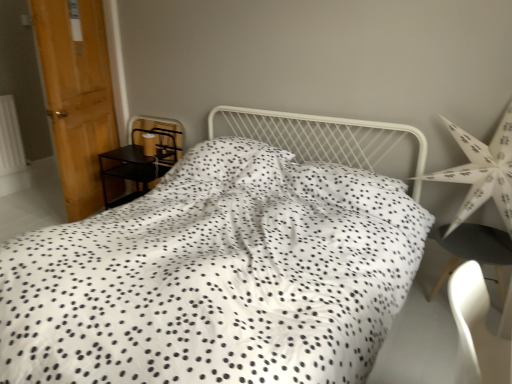
Question: Can you confirm if black metal nightstand at left is wider than matte brown lampshade at left?

Choices:
 (A) yes
 (B) no

Answer: (A)

Question: From a real-world perspective, is black metal nightstand at left below matte brown lampshade at left?

Choices:
 (A) no
 (B) yes

Answer: (B)

Question: From the image's perspective, does black metal nightstand at left appear lower than matte brown lampshade at left?

Choices:
 (A) yes
 (B) no

Answer: (A)

Question: Is the depth of black metal nightstand at left greater than that of matte brown lampshade at left?

Choices:
 (A) no
 (B) yes

Answer: (A)

Question: Is black metal nightstand at left turned away from matte brown lampshade at left?

Choices:
 (A) no
 (B) yes

Answer: (A)

Question: From a real-world perspective, is black metal nightstand at left physically above matte brown lampshade at left?

Choices:
 (A) yes
 (B) no

Answer: (B)

Question: Considering the relative positions of white paper star at right and matte brown lampshade at left in the image provided, is white paper star at right behind matte brown lampshade at left?

Choices:
 (A) no
 (B) yes

Answer: (A)

Question: Does white paper star at right have a lesser width compared to matte brown lampshade at left?

Choices:
 (A) no
 (B) yes

Answer: (A)

Question: Is white paper star at right directly adjacent to matte brown lampshade at left?

Choices:
 (A) no
 (B) yes

Answer: (A)

Question: Is white paper star at right outside matte brown lampshade at left?

Choices:
 (A) yes
 (B) no

Answer: (A)

Question: Is white paper star at right closer to the viewer compared to matte brown lampshade at left?

Choices:
 (A) yes
 (B) no

Answer: (A)

Question: Does white paper star at right have a greater height compared to matte brown lampshade at left?

Choices:
 (A) yes
 (B) no

Answer: (A)

Question: Considering the relative positions of black matte chair at lower right and wooden door at left in the image provided, is black matte chair at lower right in front of wooden door at left?

Choices:
 (A) yes
 (B) no

Answer: (A)